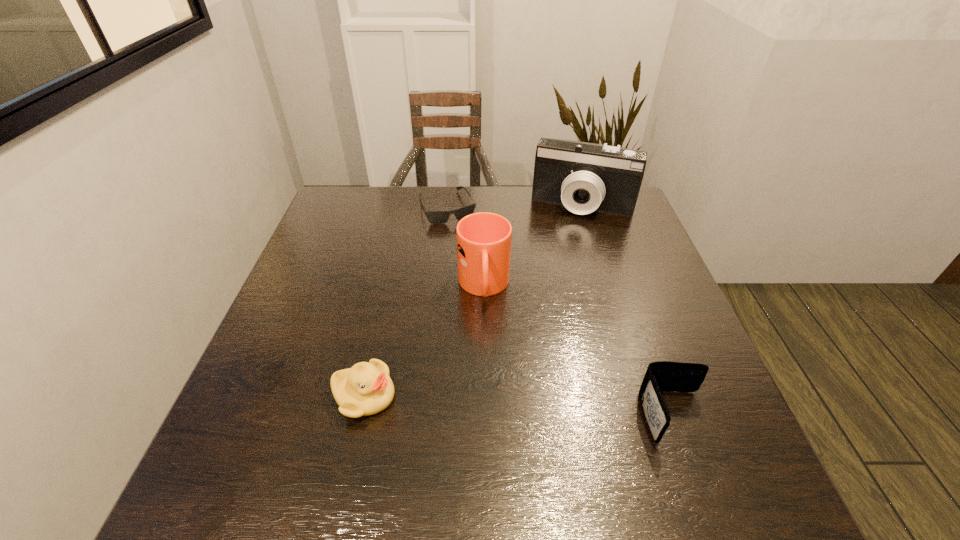
Image resolution: width=960 pixels, height=540 pixels. Find the location of `wallet situated at the right edge`. wallet situated at the right edge is located at coordinates (660, 376).

Find the location of `camcorder that is at the right edge`. camcorder that is at the right edge is located at coordinates (584, 177).

At what (x,y) coordinates should I click in order to perform the action: click on object positioned at the far right corner. Please return your answer as a coordinate pair (x, y). Looking at the image, I should click on (584, 177).

The image size is (960, 540). Identify the location of object that is at the near right corner. (660, 376).

The image size is (960, 540). I want to click on free space at the far edge of the desktop, so click(x=493, y=191).

Where is `vacant space at the near edge`? vacant space at the near edge is located at coordinates (536, 406).

I want to click on free spot at the left edge of the desktop, so click(349, 273).

The width and height of the screenshot is (960, 540). Find the location of `free space at the right edge`. free space at the right edge is located at coordinates (682, 393).

In the image, there is a desktop. Identify the location of free space at the near left corner. This screenshot has height=540, width=960. (242, 404).

Where is `free space at the far right corner`? free space at the far right corner is located at coordinates (593, 222).